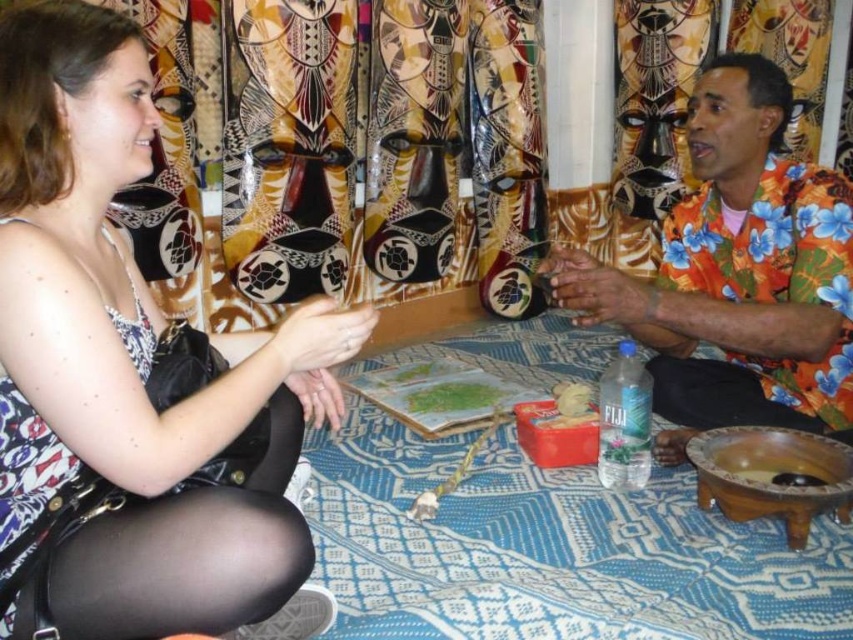
Question: Which point is closer to the camera?

Choices:
 (A) (730, 353)
 (B) (129, 259)
 (C) (477, 403)

Answer: (B)

Question: Which point is closer to the camera taking this photo?

Choices:
 (A) (498, 401)
 (B) (144, 609)
 (C) (834, 387)

Answer: (B)

Question: Which of these objects is positioned closest to the green matte paper at center?

Choices:
 (A) orange floral shirt at right
 (B) matte black dress at left

Answer: (A)

Question: Is the position of orange floral shirt at right more distant than that of green matte paper at center?

Choices:
 (A) yes
 (B) no

Answer: (B)

Question: Is matte black dress at left below green matte paper at center?

Choices:
 (A) no
 (B) yes

Answer: (A)

Question: Does orange floral shirt at right have a smaller size compared to green matte paper at center?

Choices:
 (A) no
 (B) yes

Answer: (A)